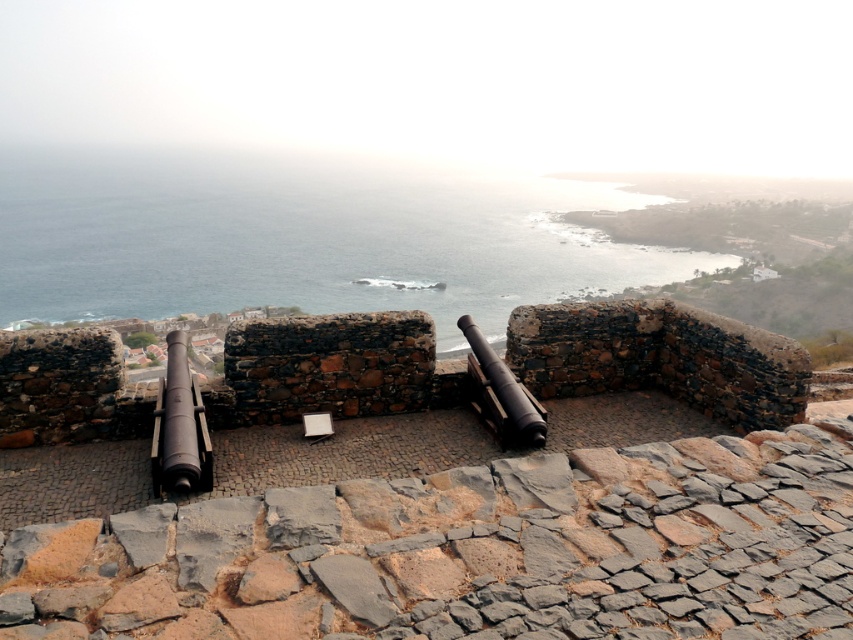
Question: Which point is farther to the camera?

Choices:
 (A) (496, 420)
 (B) (210, 228)
 (C) (181, 404)

Answer: (B)

Question: Which point is closer to the camera?

Choices:
 (A) (490, 401)
 (B) (575, 182)

Answer: (A)

Question: Can you confirm if blue water at center is smaller than rusty metal cannon at center?

Choices:
 (A) yes
 (B) no

Answer: (B)

Question: Can you confirm if blue water at center is thinner than polished bronze cannon at left?

Choices:
 (A) yes
 (B) no

Answer: (B)

Question: Which object appears closest to the camera in this image?

Choices:
 (A) blue water at center
 (B) polished bronze cannon at left

Answer: (B)

Question: Does polished bronze cannon at left appear over rusty metal cannon at center?

Choices:
 (A) no
 (B) yes

Answer: (A)